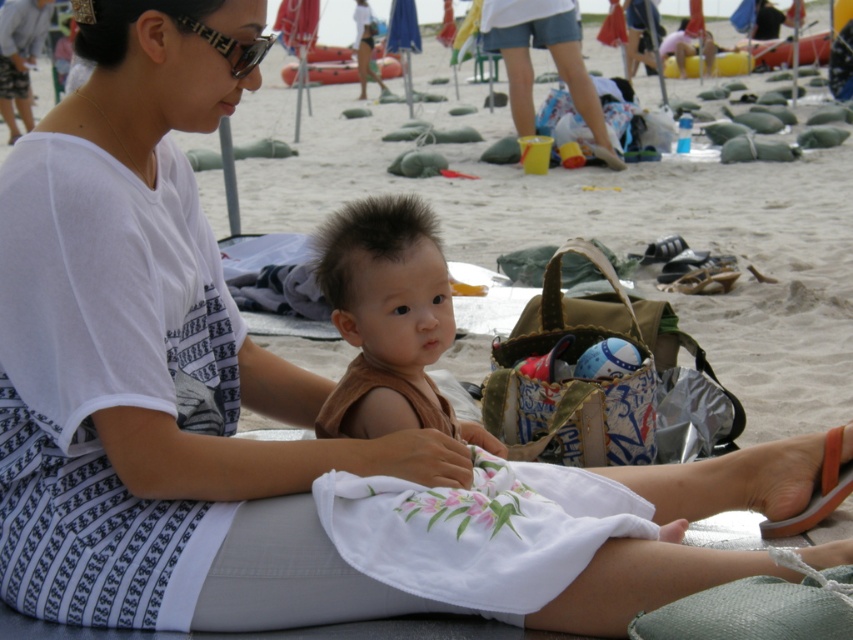
Is brown cotton shirt at center smaller than white cotton dress at center?

Yes, brown cotton shirt at center is smaller than white cotton dress at center.

The width and height of the screenshot is (853, 640). Describe the element at coordinates (386, 317) in the screenshot. I see `brown cotton shirt at center` at that location.

Identify the location of brown cotton shirt at center. (386, 317).

Who is positioned more to the left, brown cotton shirt at center or orange rubber sandal at lower right?

Positioned to the left is brown cotton shirt at center.

What do you see at coordinates (386, 317) in the screenshot?
I see `brown cotton shirt at center` at bounding box center [386, 317].

Find the location of a particular element. brown cotton shirt at center is located at coordinates (386, 317).

This screenshot has height=640, width=853. What are the coordinates of `brown cotton shirt at center` in the screenshot? It's located at pyautogui.click(x=386, y=317).

Is white cotton dress at center to the right of orange rubber sandal at lower right from the viewer's perspective?

Yes, white cotton dress at center is to the right of orange rubber sandal at lower right.

Which is more to the right, white cotton dress at center or orange rubber sandal at lower right?

From the viewer's perspective, white cotton dress at center appears more on the right side.

Between point (547, 17) and point (833, 432), which one is positioned in front?

Point (833, 432)

The image size is (853, 640). What are the coordinates of `white cotton dress at center` in the screenshot? It's located at (552, 58).